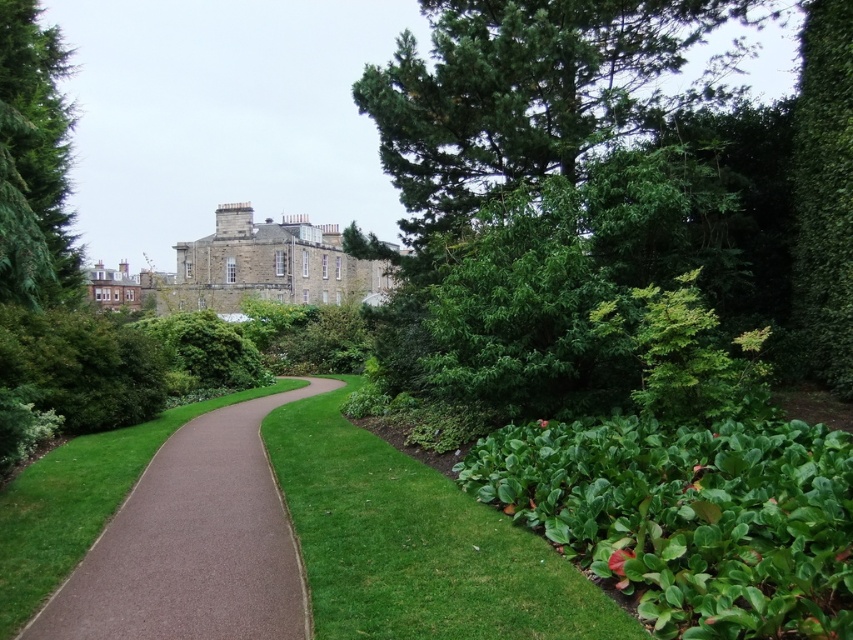
You are a gardener planning to water the green leafy tree at upper right and the brown textured path at center. Since the path is paved and the tree is a plant, which one should you water first to ensure proper care?

You should water the green leafy tree at upper right first because the brown textured path at center is behind it, so watering the tree first will prevent water from splashing onto the path and causing potential slipping hazards.

You are a visitor walking along the garden pathway and want to take a photo of both the green leafy tree at upper right and the green leafy tree at upper left. Since you have a wide angle lens, will you be able to capture both trees in the same frame?

The green leafy tree at upper left is behind the green leafy tree at upper right, so you might not be able to see both trees clearly in the same frame if they are overlapping. However, since you have a wide angle lens, you can adjust your position to include both trees in the shot by moving back or angling the camera appropriately.